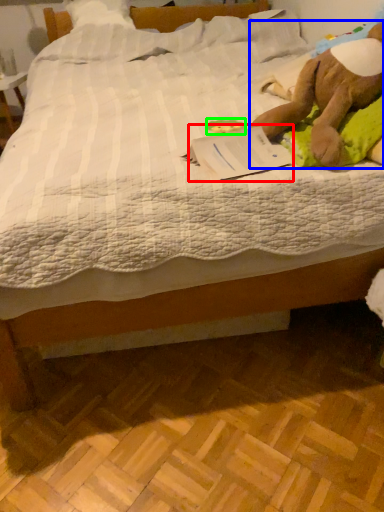
Question: Estimate the real-world distances between objects in this image. Which object is closer to paperback book (highlighted by a red box), animal (highlighted by a blue box) or toy (highlighted by a green box)?

Choices:
 (A) animal
 (B) toy

Answer: (A)